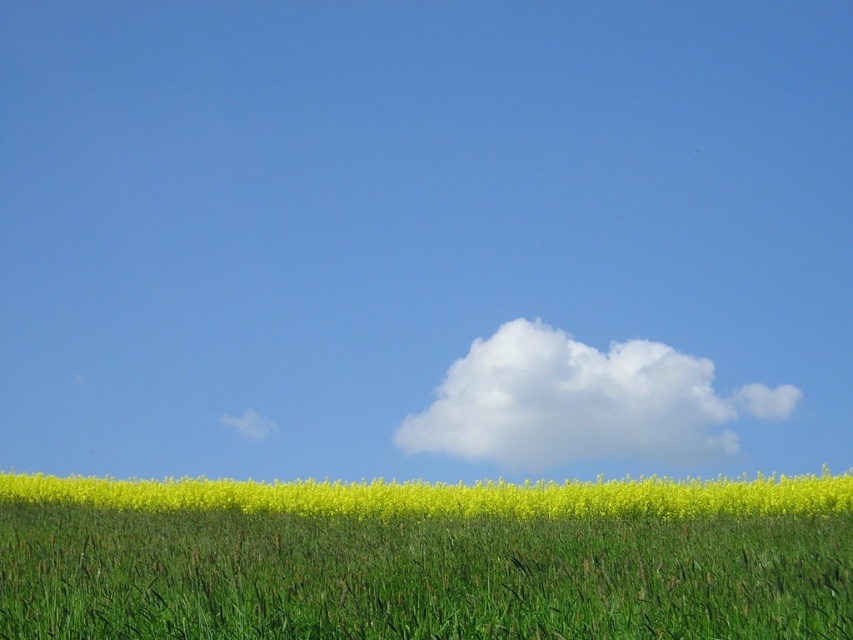
Question: Which object is positioned farthest from the yellow matte flower at lower center?

Choices:
 (A) white fluffy cloud at upper center
 (B) green grass at lower center

Answer: (B)

Question: Does green grass at lower center come behind white fluffy cloud at upper center?

Choices:
 (A) no
 (B) yes

Answer: (A)

Question: Can you confirm if green grass at lower center is bigger than white fluffy cloud at upper center?

Choices:
 (A) no
 (B) yes

Answer: (A)

Question: Does green grass at lower center come behind yellow matte flower at lower center?

Choices:
 (A) no
 (B) yes

Answer: (A)

Question: Which of the following is the closest to the observer?

Choices:
 (A) white fluffy cloud at upper center
 (B) yellow matte flower at lower center

Answer: (B)

Question: Which is farther from the white fluffy cloud at upper center?

Choices:
 (A) yellow matte flower at lower center
 (B) green grass at lower center

Answer: (B)